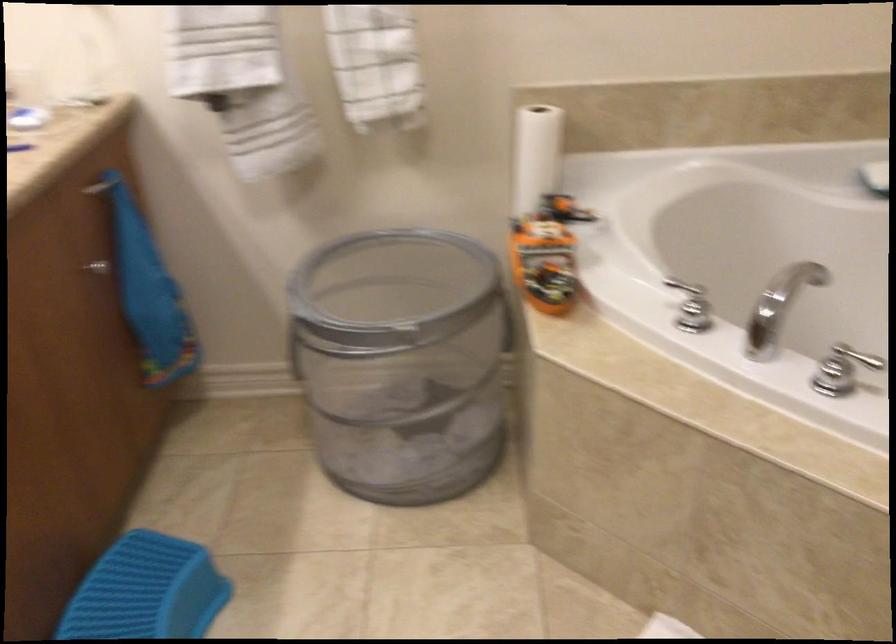
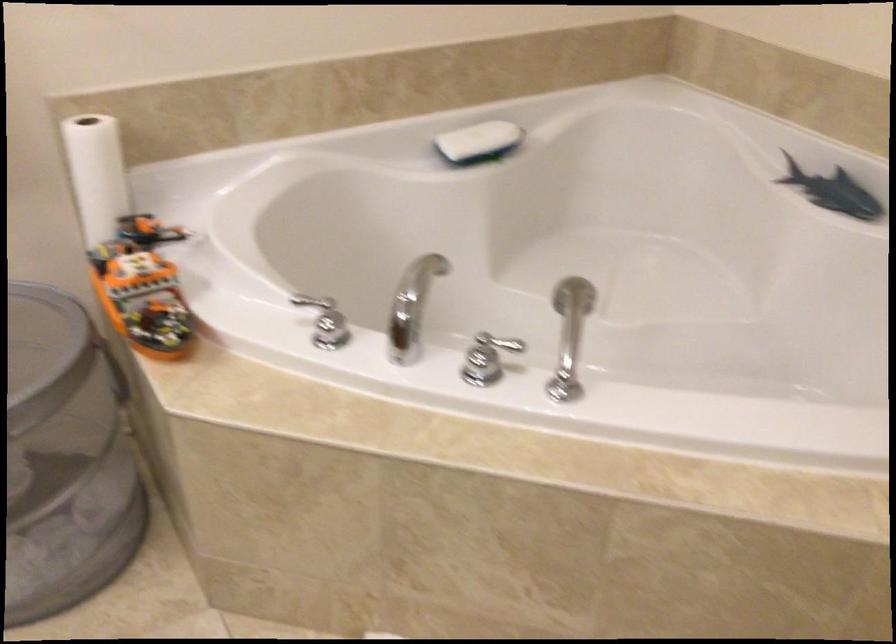
Question: The first image is from the beginning of the video and the second image is from the end. How did the camera likely rotate when shooting the video?

Choices:
 (A) Left
 (B) Right
 (C) Up
 (D) Down

Answer: (B)